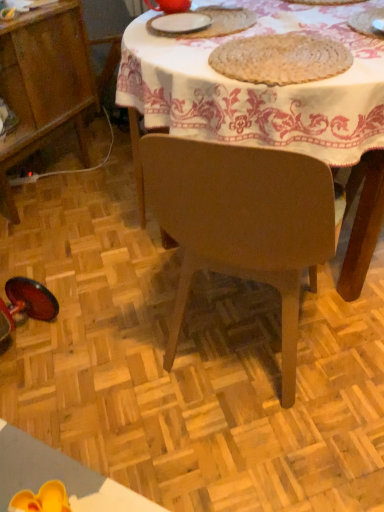
I want to click on free location in front of matte red teapot at upper center, the 3th tableware in the right-to-left sequence, so click(168, 32).